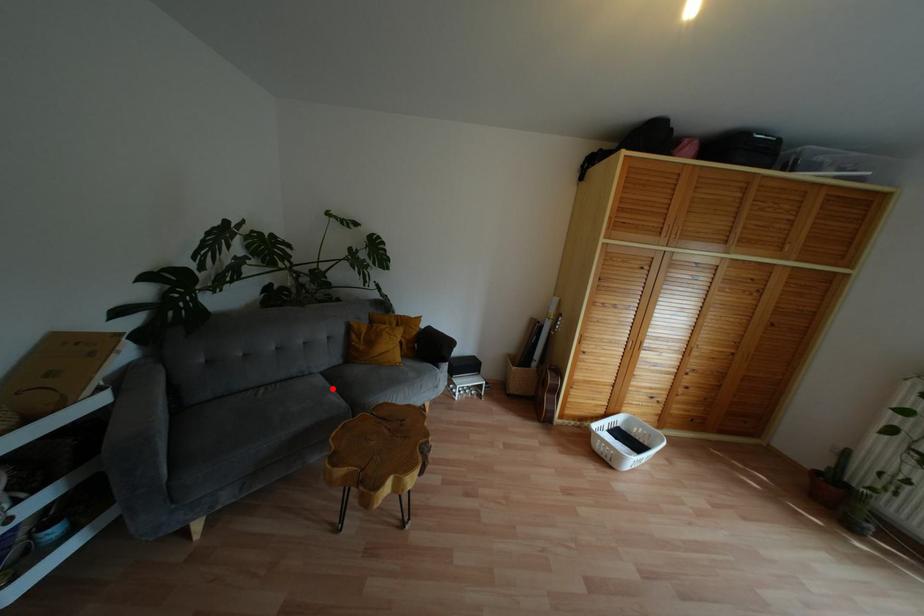
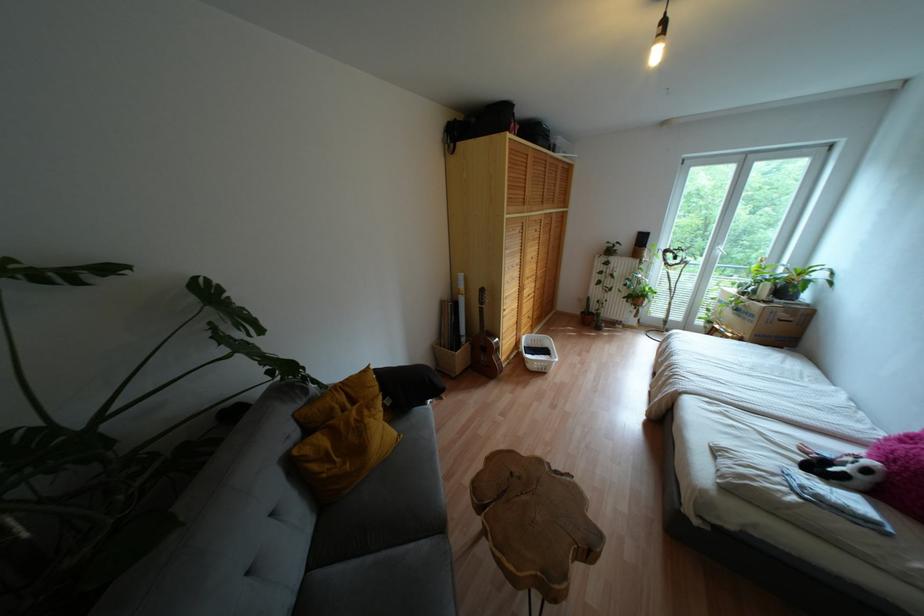
Find the pixel in the second image that matches the highlighted location in the first image.

(383, 553)